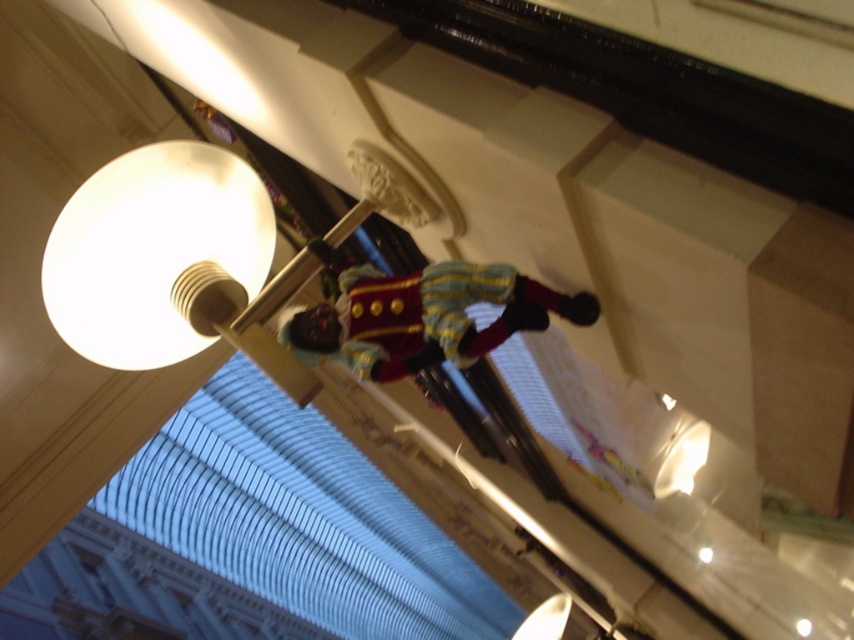
Can you confirm if white matte lamp at upper left is taller than velvet gold-trimmed toy soldier at center?

Indeed, white matte lamp at upper left has a greater height compared to velvet gold-trimmed toy soldier at center.

Is white matte lamp at upper left positioned behind velvet gold-trimmed toy soldier at center?

No, it is in front of velvet gold-trimmed toy soldier at center.

Describe the element at coordinates (154, 252) in the screenshot. I see `white matte lamp at upper left` at that location.

You are a GUI agent. You are given a task and a screenshot of the screen. Output one action in this format:
    pyautogui.click(x=<x>, y=<y>)
    Task: Click on the white matte lamp at upper left
    Image resolution: width=854 pixels, height=640 pixels.
    Given the screenshot: What is the action you would take?
    tap(154, 252)